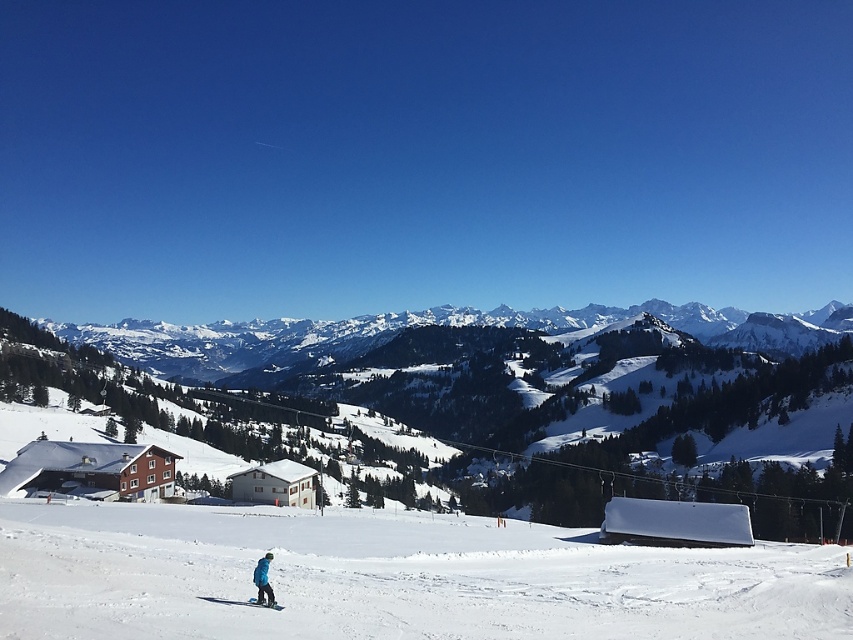
You are standing at the point marked as point (267, 556) in the winter landscape image. If you want to take a photo of the snow covered slope and the small buildings in the midground, will you be able to capture both in a single frame?

The distance of point (267, 556) from camera is 195.78 feet, so you can capture both the snow covered slope and the small buildings in the midground in a single frame since they are within the camera range.

From the picture: You are an observer looking at the winter scene. You notice the blue fabric snowsuit at lower center and the matte blue ski at lower center. Which object takes up more space in the image?

The blue fabric snowsuit at lower center takes up more space in the image because it is larger in size than the matte blue ski at lower center.